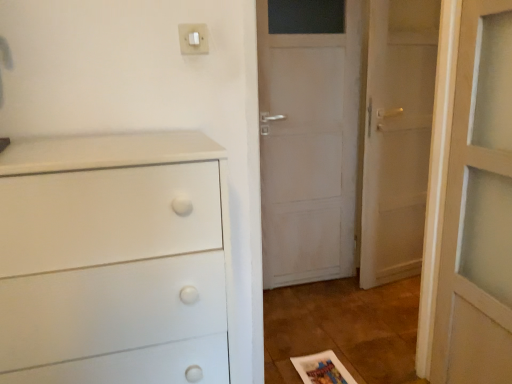
Describe the element at coordinates (114, 259) in the screenshot. The height and width of the screenshot is (384, 512). I see `white matte chest of drawers at left` at that location.

Locate an element on the screen. The width and height of the screenshot is (512, 384). white wooden door at right is located at coordinates (397, 137).

Measure the distance from white matte chest of drawers at left to white plastic light switch at upper center.

They are 25.66 inches apart.

Are white matte chest of drawers at left and white plastic light switch at upper center beside each other?

They are not placed beside each other.

Considering the relative sizes of white matte chest of drawers at left and white plastic light switch at upper center in the image provided, is white matte chest of drawers at left wider than white plastic light switch at upper center?

Indeed, white matte chest of drawers at left has a greater width compared to white plastic light switch at upper center.

From the image's perspective, is white matte chest of drawers at left located beneath white plastic light switch at upper center?

Yes, from the image's perspective, white matte chest of drawers at left is below white plastic light switch at upper center.

Considering the relative sizes of white plastic light switch at upper center and white matte chest of drawers at left in the image provided, is white plastic light switch at upper center bigger than white matte chest of drawers at left?

Incorrect, white plastic light switch at upper center is not larger than white matte chest of drawers at left.

Considering the points (191, 31) and (188, 284), which point is behind, point (191, 31) or point (188, 284)?

The point (191, 31) is more distant.

Is white plastic light switch at upper center wider or thinner than white matte chest of drawers at left?

white plastic light switch at upper center is thinner than white matte chest of drawers at left.

What's the angular difference between white plastic light switch at upper center and white matte chest of drawers at left's facing directions?

They differ by 0.0976 degrees in their facing directions.

From a real-world perspective, is white plastic light switch at upper center positioned under white wooden door at right based on gravity?

Incorrect, from a real-world perspective, white plastic light switch at upper center is higher than white wooden door at right.

Who is taller, white plastic light switch at upper center or white wooden door at right?

Standing taller between the two is white wooden door at right.

This screenshot has height=384, width=512. What are the coordinates of `light switch above the white wooden door at right (from a real-world perspective)` in the screenshot? It's located at (193, 38).

I want to click on door below the white plastic light switch at upper center (from the image's perspective), so point(397,137).

From the image's perspective, which is below, white wooden door at right or white plastic light switch at upper center?

white wooden door at right.

Does white wooden door at right touch white plastic light switch at upper center?

They are not placed beside each other.

Can you tell me how much white wooden door at right and white plastic light switch at upper center differ in facing direction?

white wooden door at right and white plastic light switch at upper center are facing 9.11 degrees away from each other.

Considering the relative sizes of white matte chest of drawers at left and white wooden door at right in the image provided, is white matte chest of drawers at left taller than white wooden door at right?

No, white matte chest of drawers at left is not taller than white wooden door at right.

Is white matte chest of drawers at left spatially inside white wooden door at right, or outside of it?

white matte chest of drawers at left lies outside white wooden door at right.

Is white matte chest of drawers at left to the right of white wooden door at right from the viewer's perspective?

In fact, white matte chest of drawers at left is to the left of white wooden door at right.

Based on the photo, from a real-world perspective, is white matte chest of drawers at left positioned over white wooden door at right based on gravity?

Actually, white matte chest of drawers at left is physically below white wooden door at right in the real world.

Based on the photo, is white wooden door at right in front of or behind white matte chest of drawers at left in the image?

In the image, white wooden door at right appears behind white matte chest of drawers at left.

From a real-world perspective, is white wooden door at right positioned above or below white matte chest of drawers at left?

In terms of real-world spatial position, white wooden door at right is above white matte chest of drawers at left.

Between point (409, 120) and point (181, 356), which one is positioned in front?

The point (181, 356) is in front.

Is white wooden door at right shorter than white matte chest of drawers at left?

In fact, white wooden door at right may be taller than white matte chest of drawers at left.

In the image, there is a white matte chest of drawers at left. Where is `light switch above it (from the image's perspective)`? This screenshot has width=512, height=384. light switch above it (from the image's perspective) is located at coordinates (193, 38).

The image size is (512, 384). Find the location of `the chest of drawers that appears in front of the white plastic light switch at upper center`. the chest of drawers that appears in front of the white plastic light switch at upper center is located at coordinates (114, 259).

Based on their spatial positions, is white wooden door at right or white matte chest of drawers at left closer to white plastic light switch at upper center?

white matte chest of drawers at left is positioned closer to the anchor white plastic light switch at upper center.

Considering their positions, is white matte chest of drawers at left positioned further to white plastic light switch at upper center than white wooden door at right?

Among the two, white wooden door at right is located further to white plastic light switch at upper center.

Considering their positions, is white matte chest of drawers at left positioned further to white wooden door at right than white plastic light switch at upper center?

Based on the image, white matte chest of drawers at left appears to be further to white wooden door at right.

Estimate the real-world distances between objects in this image. Which object is further from white wooden door at right, white plastic light switch at upper center or white matte chest of drawers at left?

white matte chest of drawers at left.

Based on their spatial positions, is white plastic light switch at upper center or white wooden door at right further from white matte chest of drawers at left?

white wooden door at right is further to white matte chest of drawers at left.

Which object lies nearer to the anchor point white matte chest of drawers at left, white wooden door at right or white plastic light switch at upper center?

white plastic light switch at upper center.

Identify the location of light switch located between white matte chest of drawers at left and white wooden door at right in the depth direction. (193, 38).